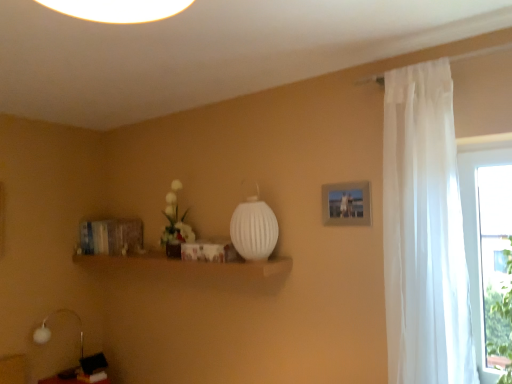
Question: Is white ribbed glass vase at center further to camera compared to white sheer curtain at right?

Choices:
 (A) yes
 (B) no

Answer: (A)

Question: From the image's perspective, is white ribbed glass vase at center located above white sheer curtain at right?

Choices:
 (A) no
 (B) yes

Answer: (A)

Question: Considering the relative sizes of white ribbed glass vase at center and white sheer curtain at right in the image provided, is white ribbed glass vase at center shorter than white sheer curtain at right?

Choices:
 (A) no
 (B) yes

Answer: (B)

Question: Is white ribbed glass vase at center at the right side of white sheer curtain at right?

Choices:
 (A) yes
 (B) no

Answer: (B)

Question: From a real-world perspective, is white ribbed glass vase at center positioned over white sheer curtain at right based on gravity?

Choices:
 (A) yes
 (B) no

Answer: (A)

Question: Is white sheer curtain at right wider or thinner than matte silver picture frame at upper right?

Choices:
 (A) thin
 (B) wide

Answer: (B)

Question: Is white sheer curtain at right to the left or to the right of matte silver picture frame at upper right in the image?

Choices:
 (A) left
 (B) right

Answer: (B)

Question: From their relative heights in the image, would you say white sheer curtain at right is taller or shorter than matte silver picture frame at upper right?

Choices:
 (A) short
 (B) tall

Answer: (B)

Question: Considering the positions of point (408, 294) and point (348, 203), is point (408, 294) closer or farther from the camera than point (348, 203)?

Choices:
 (A) farther
 (B) closer

Answer: (B)

Question: Considering the positions of point (244, 246) and point (39, 340), is point (244, 246) closer or farther from the camera than point (39, 340)?

Choices:
 (A) farther
 (B) closer

Answer: (B)

Question: Looking at their shapes, would you say white ribbed glass vase at center is wider or thinner than white fabric table lamp at lower left?

Choices:
 (A) wide
 (B) thin

Answer: (A)

Question: In terms of height, does white ribbed glass vase at center look taller or shorter compared to white fabric table lamp at lower left?

Choices:
 (A) tall
 (B) short

Answer: (B)

Question: Is white ribbed glass vase at center in front of or behind white fabric table lamp at lower left in the image?

Choices:
 (A) front
 (B) behind

Answer: (A)

Question: Based on their positions, is white fabric table lamp at lower left located to the left or right of matte silver picture frame at upper right?

Choices:
 (A) left
 (B) right

Answer: (A)

Question: In the image, is white fabric table lamp at lower left positioned in front of or behind matte silver picture frame at upper right?

Choices:
 (A) behind
 (B) front

Answer: (A)